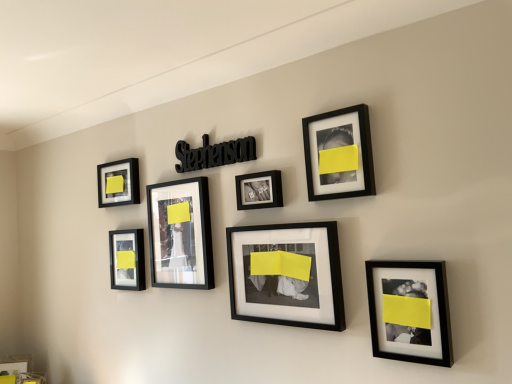
Question: From a real-world perspective, is matte black picture frame at upper left, which ranks as the seventh picture frame in right-to-left order, physically located above or below matte black picture frame at lower left, the 6th picture frame when ordered from right to left?

Choices:
 (A) above
 (B) below

Answer: (A)

Question: From the image's perspective, is matte black picture frame at upper left, acting as the first picture frame starting from the left, located above or below matte black picture frame at lower left, the 2th picture frame in the left-to-right sequence?

Choices:
 (A) above
 (B) below

Answer: (A)

Question: Estimate the real-world distances between objects in this image. Which object is closer to the black matte picture frame at upper right, the sixth picture frame viewed from the left?

Choices:
 (A) matte black photo frame at center, marked as the 4th picture frame in a right-to-left arrangement
 (B) black matte picture frame at lower right, acting as the 1th picture frame starting from the right
 (C) matte black picture frame at upper left, which ranks as the seventh picture frame in right-to-left order
 (D) matte black frame at center, which ranks as the third picture frame in right-to-left order
 (E) matte black picture frame at lower left, the 2th picture frame in the left-to-right sequence

Answer: (A)

Question: Based on their relative distances, which object is farther from the matte black photo frame at center, positioned as the 4th picture frame in left-to-right order?

Choices:
 (A) matte black picture frame at upper left, which ranks as the seventh picture frame in right-to-left order
 (B) black matte picture frame at upper right, the sixth picture frame viewed from the left
 (C) matte black frame at center, the fifth picture frame in the right-to-left sequence
 (D) matte black frame at center, which ranks as the third picture frame in right-to-left order
 (E) black matte picture frame at lower right, acting as the 1th picture frame starting from the right

Answer: (A)